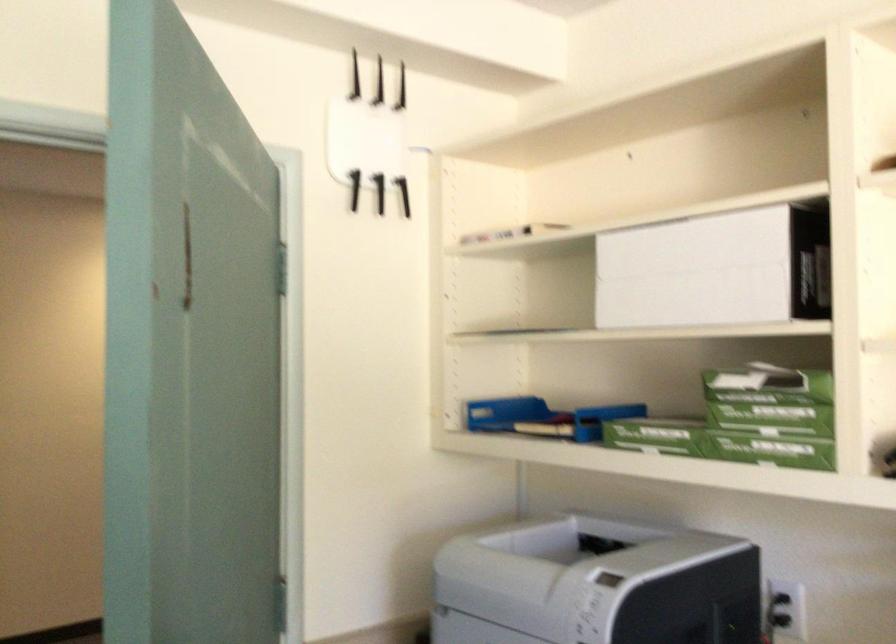
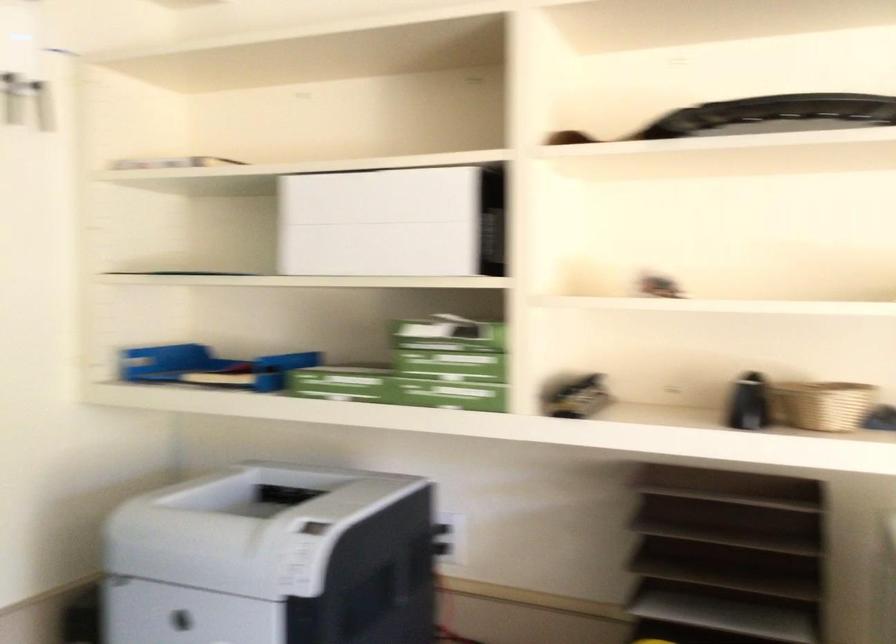
The point at (x=686, y=275) is marked in the first image. Where is the corresponding point in the second image?

(380, 223)